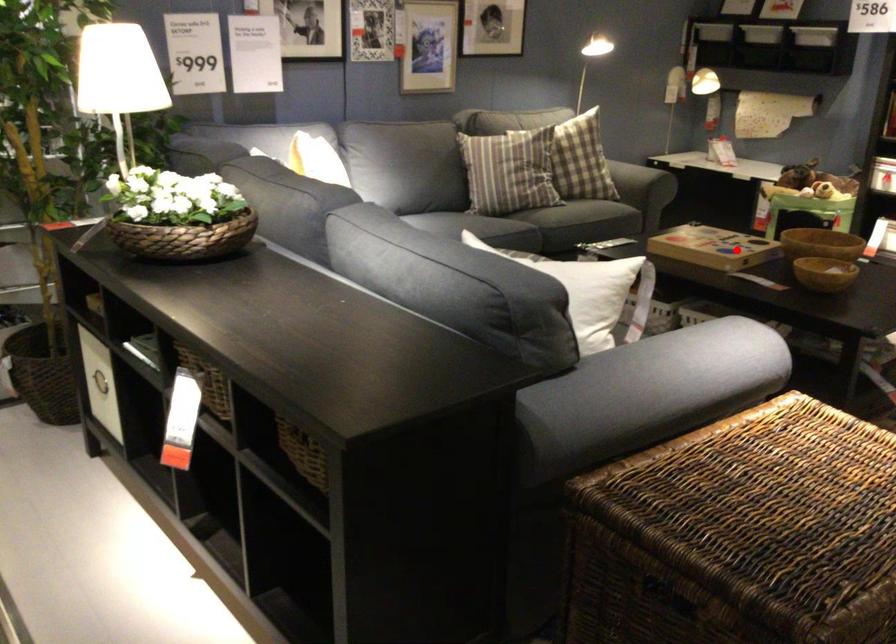
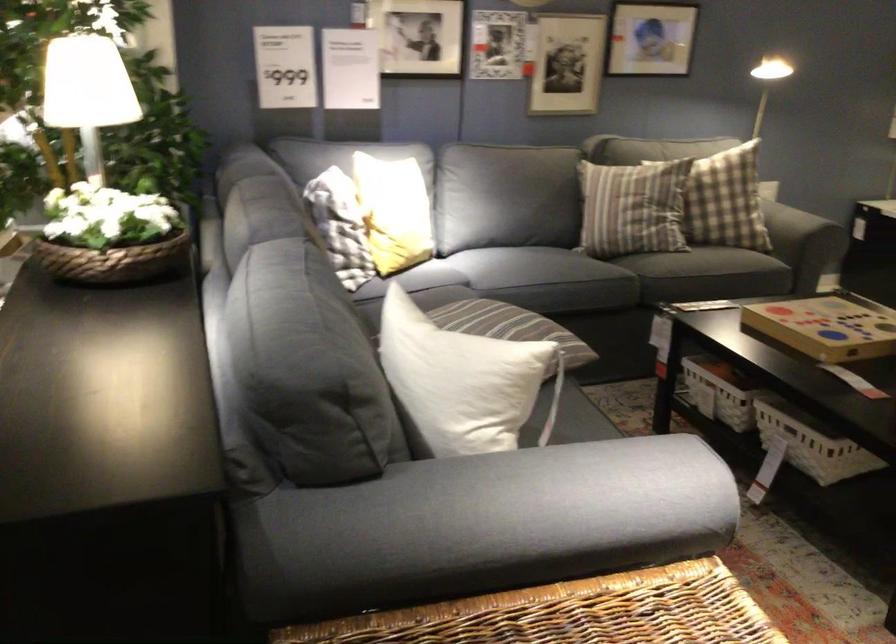
Question: I am providing you with two images of the same scene from different viewpoints. In image1, a red point is highlighted. Considering the same 3D point in image2, which of the following is correct?

Choices:
 (A) It is closer
 (B) It is farther

Answer: (A)